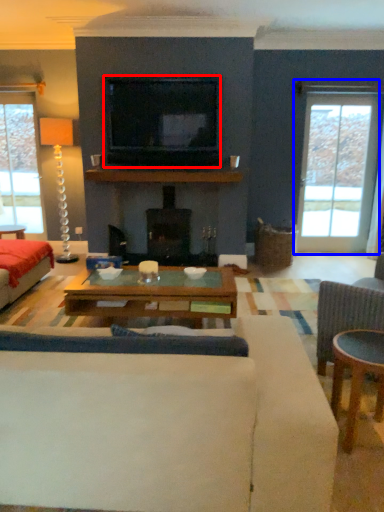
Question: Which point is further to the camera, television (highlighted by a red box) or window (highlighted by a blue box)?

Choices:
 (A) television
 (B) window

Answer: (B)